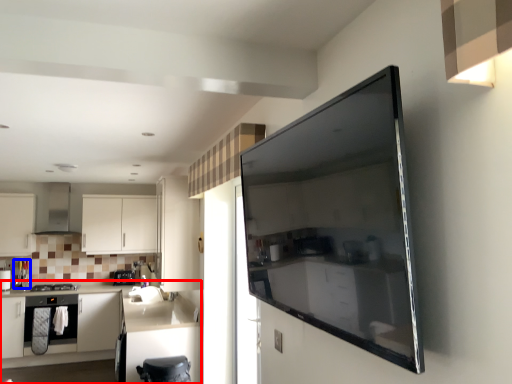
Question: Which object is closer to the camera taking this photo, cabinetry (highlighted by a red box) or appliance (highlighted by a blue box)?

Choices:
 (A) cabinetry
 (B) appliance

Answer: (A)